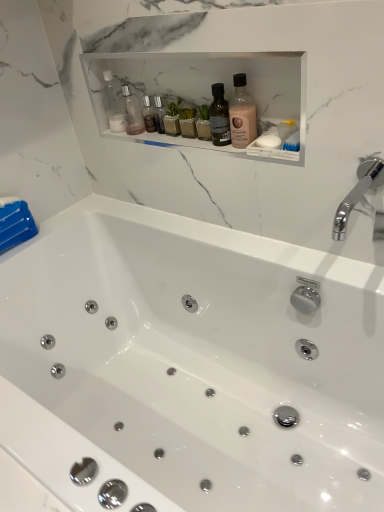
Question: Does white glossy bathtub at center lie in front of transparent plastic bottle at upper center, marked as the 3th bottle in a front-to-back arrangement?

Choices:
 (A) no
 (B) yes

Answer: (B)

Question: Is white glossy bathtub at center at the left side of transparent plastic bottle at upper center, marked as the 3th bottle in a front-to-back arrangement?

Choices:
 (A) yes
 (B) no

Answer: (B)

Question: Is the surface of white glossy bathtub at center in direct contact with transparent plastic bottle at upper center, positioned as the second bottle in left-to-right order?

Choices:
 (A) no
 (B) yes

Answer: (A)

Question: Can you confirm if white glossy bathtub at center is wider than transparent plastic bottle at upper center, positioned as the second bottle in left-to-right order?

Choices:
 (A) no
 (B) yes

Answer: (B)

Question: From a real-world perspective, is white glossy bathtub at center under transparent plastic bottle at upper center, the 2th bottle positioned from the right?

Choices:
 (A) yes
 (B) no

Answer: (A)

Question: Choose the correct answer: Is transparent plastic bottle at upper center, acting as the second bottle starting from the front, inside pink matte bottle at center, the 1th bottle viewed from the front, or outside it?

Choices:
 (A) inside
 (B) outside

Answer: (B)

Question: Considering the positions of point (104, 102) and point (235, 122), is point (104, 102) closer or farther from the camera than point (235, 122)?

Choices:
 (A) farther
 (B) closer

Answer: (A)

Question: In the image, is transparent plastic bottle at upper center, acting as the second bottle starting from the front, positioned in front of or behind pink matte bottle at center, arranged as the 3th bottle when viewed from the left?

Choices:
 (A) behind
 (B) front

Answer: (A)

Question: Based on their sizes in the image, would you say transparent plastic bottle at upper center, which ranks as the second bottle in back-to-front order, is bigger or smaller than pink matte bottle at center, the 1th bottle viewed from the front?

Choices:
 (A) small
 (B) big

Answer: (B)

Question: From the image's perspective, is white glossy bathtub at center above or below chrome metallic faucet at upper right?

Choices:
 (A) below
 (B) above

Answer: (A)

Question: Is white glossy bathtub at center wider or thinner than chrome metallic faucet at upper right?

Choices:
 (A) thin
 (B) wide

Answer: (B)

Question: Visually, is white glossy bathtub at center positioned to the left or to the right of chrome metallic faucet at upper right?

Choices:
 (A) left
 (B) right

Answer: (A)

Question: From a real-world perspective, is white glossy bathtub at center positioned above or below chrome metallic faucet at upper right?

Choices:
 (A) below
 (B) above

Answer: (A)

Question: Do you think transparent plastic bottle at upper center, acting as the first bottle starting from the left, is within transparent plastic bottle at upper center, the 2th bottle positioned from the right, or outside of it?

Choices:
 (A) outside
 (B) inside

Answer: (A)

Question: Is transparent plastic bottle at upper center, which ranks as the second bottle in back-to-front order, taller or shorter than transparent plastic bottle at upper center, which is the 1th bottle in back-to-front order?

Choices:
 (A) short
 (B) tall

Answer: (B)